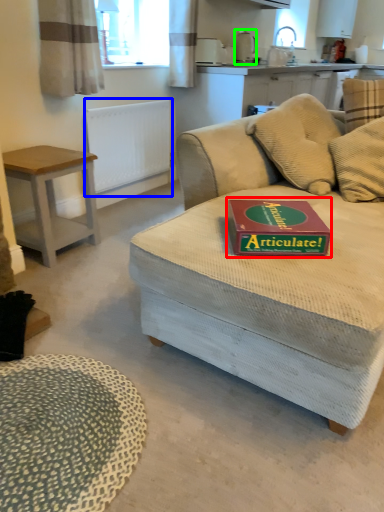
Question: Based on their relative distances, which object is farther from paperback book (highlighted by a red box)? Choose from radiator (highlighted by a blue box) and appliance (highlighted by a green box).

Choices:
 (A) radiator
 (B) appliance

Answer: (B)